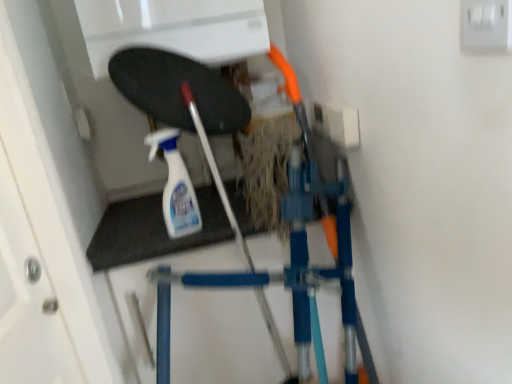
In order to click on free point behind clear plastic spray bottle at center in this screenshot , I will do `click(162, 214)`.